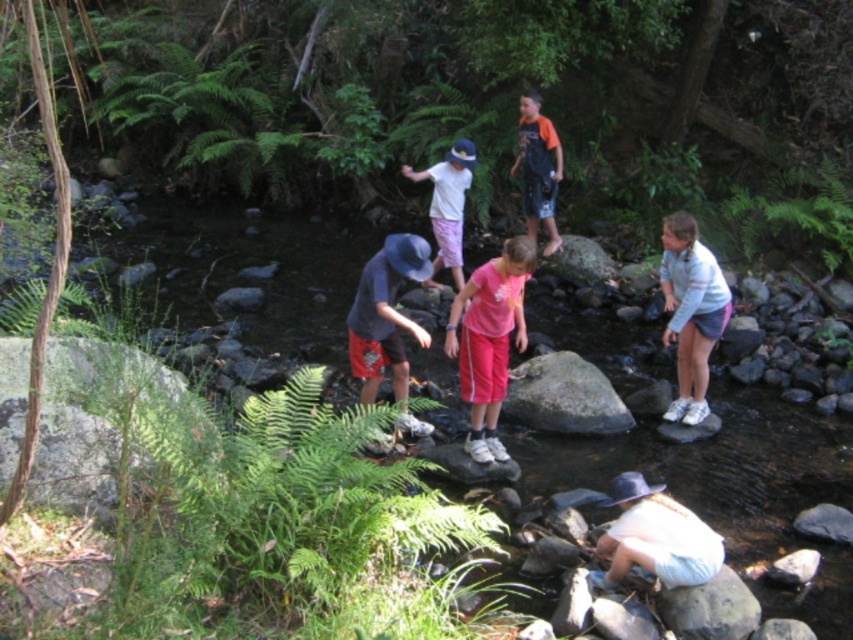
You are a child in the scene and want to cross the stream. The smooth rock creek at center is located at coordinates 0.758, 0.858. Can you step on it?

Yes, the smooth rock creek at center is located at coordinates [730,484], so you can step on it to cross the stream.

You are a child playing near the stream and want to reach the green leafy fern at upper right. Which direction should you move from the smooth rock creek at center to get there?

You should move to the right from the smooth rock creek at center to reach the green leafy fern at upper right because the smooth rock creek at center is to the left of green leafy fern at upper right.

You are standing at the point labeled as point (561, 339) in the image. The stream is flowing towards the north. If you want to walk 10 meters north from your current position, will you be able to reach the other side of the stream without crossing it?

The distance between you and the viewer is 9.27 meters. Since you want to walk 10 meters north, you will surpass the stream and reach the other side without crossing it.